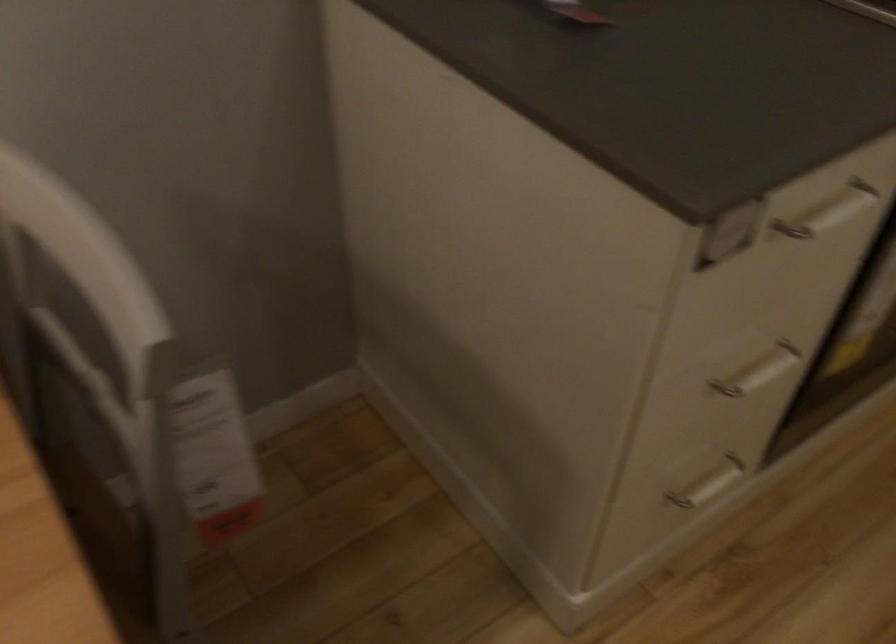
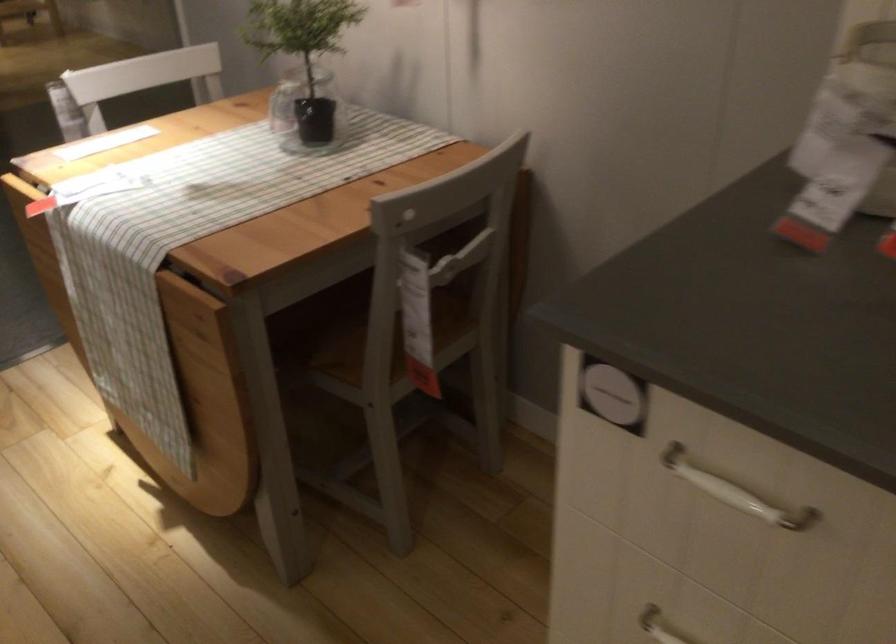
Where in the second image is the point corresponding to point 679,417 from the first image?

(659, 626)